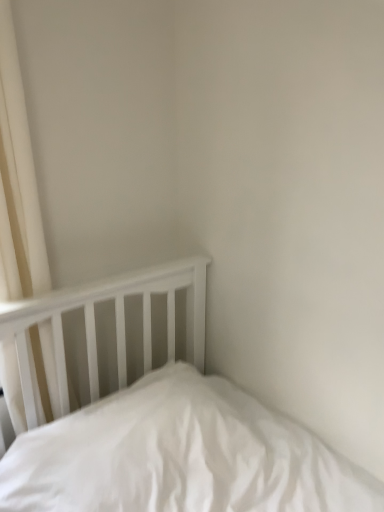
What do you see at coordinates (162, 423) in the screenshot?
I see `white matte bed at lower left` at bounding box center [162, 423].

Where is `white matte bed at lower left`? This screenshot has height=512, width=384. white matte bed at lower left is located at coordinates (162, 423).

The width and height of the screenshot is (384, 512). I want to click on white matte bed at lower left, so click(162, 423).